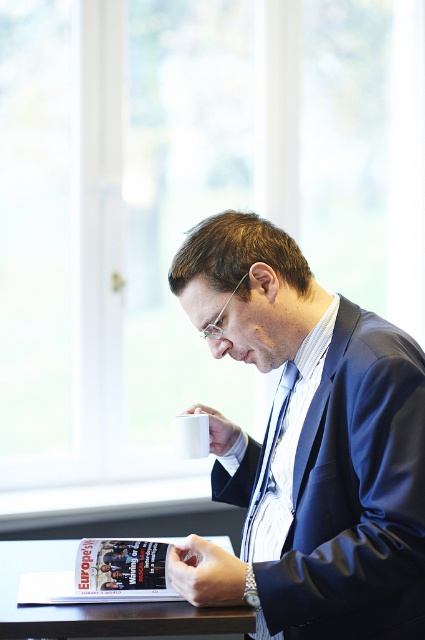
You are standing in the room and want to place a small plant between the two points, point (232, 476) and point (246, 564). Which point should the plant be closer to in order to be closer to the viewer?

The plant should be closer to point (232, 476) because it is further to the viewer than point (246, 564).

Consider the image. You are a robot trying to navigate to the point closer to the man in the image. Which point should you move towards, point (141, 566) or point (280, 429)?

Point (141, 566) is in front of point (280, 429), so you should move towards point (141, 566) as it is closer to the man.

The man is wearing a blue glossy suit at center and holding a matte paper magazine at lower center. Which object is closer to the viewer?

The blue glossy suit at center is closer to the viewer since it is in front of the matte paper magazine at lower center.